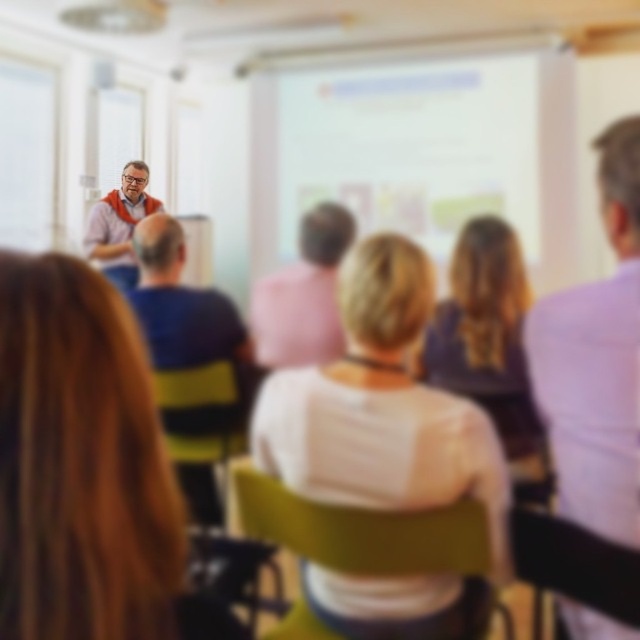
You are standing at the center of the room and want to sit down. There is a green fabric chair at center at point (371, 552). Is the green fabric chair at center located directly in front of you or to your side?

The green fabric chair at center is located at point (371, 552), which is directly in front of you since it is labeled as being at the center.

You are standing in the room and see the blonde hair at lower left. If your arm is 22 inches long, can you reach it?

The blonde hair at lower left and viewer are 23.31 inches apart. Since your arm is 22 inches long, you cannot reach it.

You are sitting in the back row of the room and want to see the blue striped shirt at center. Is the green fabric chair at center blocking your view?

The green fabric chair at center is in front of the blue striped shirt at center, so it would block your view of the blue striped shirt at center.